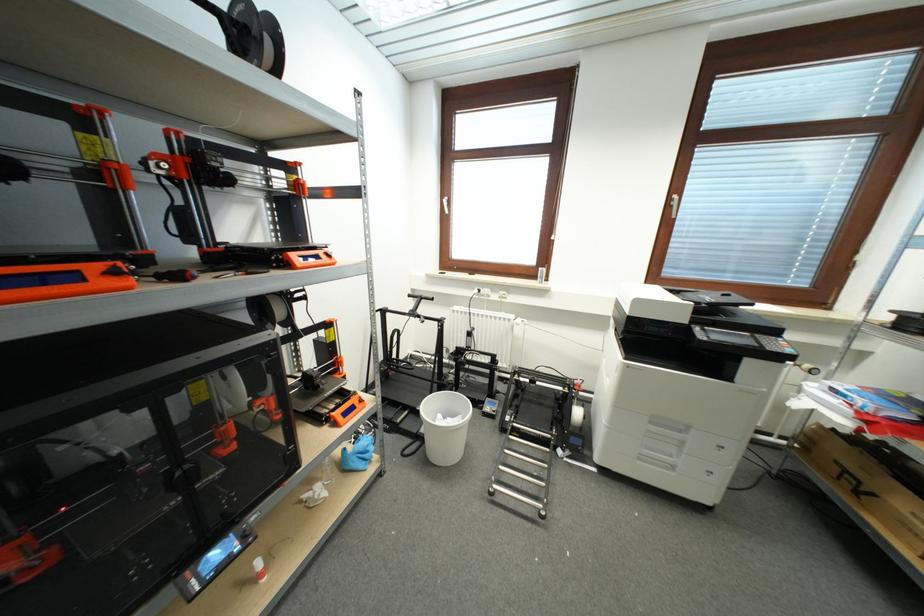
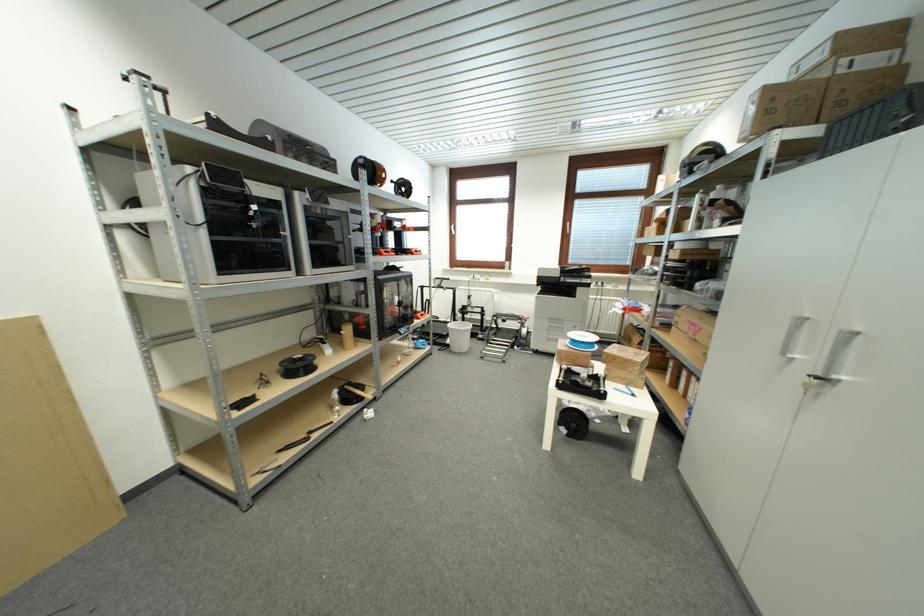
Question: Which direction would the cameraman need to move to produce the second image? Reply with the corresponding letter.

Choices:
 (A) Left
 (B) Right
 (C) Forward
 (D) Backward

Answer: (D)